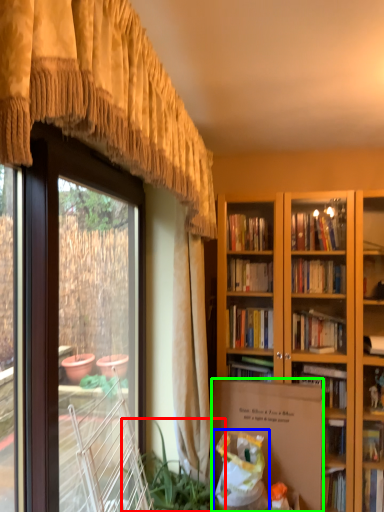
Question: Estimate the real-world distances between objects in this image. Which object is farther from houseplant (highlighted by a red box), shopping bag (highlighted by a blue box) or cardboard box (highlighted by a green box)?

Choices:
 (A) shopping bag
 (B) cardboard box

Answer: (B)